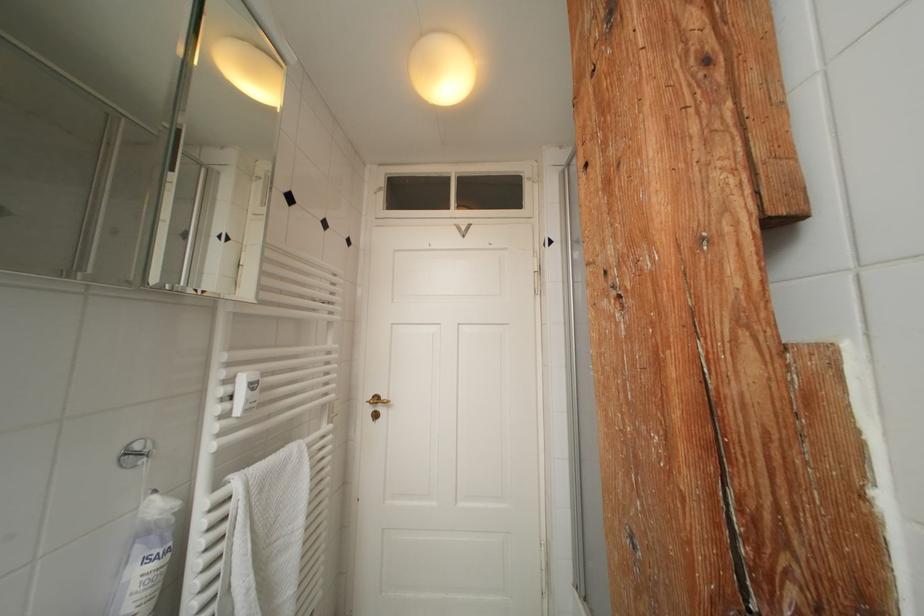
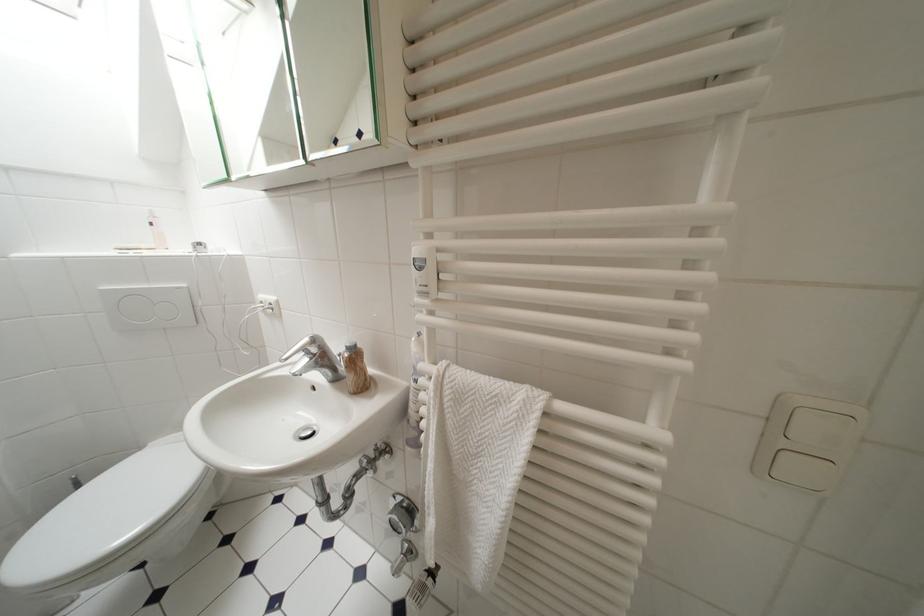
The point at (249, 507) is marked in the first image. Where is the corresponding point in the second image?

(439, 397)